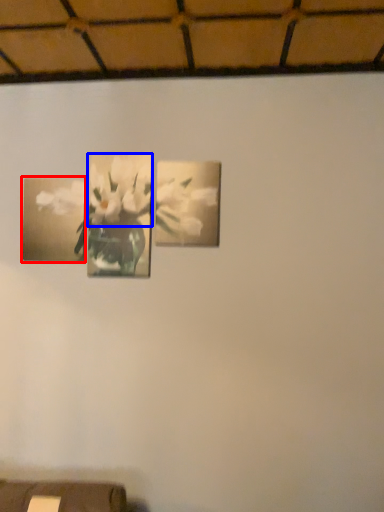
Question: Which of the following is the farthest to the observer, picture frame (highlighted by a red box) or flower (highlighted by a blue box)?

Choices:
 (A) picture frame
 (B) flower

Answer: (A)